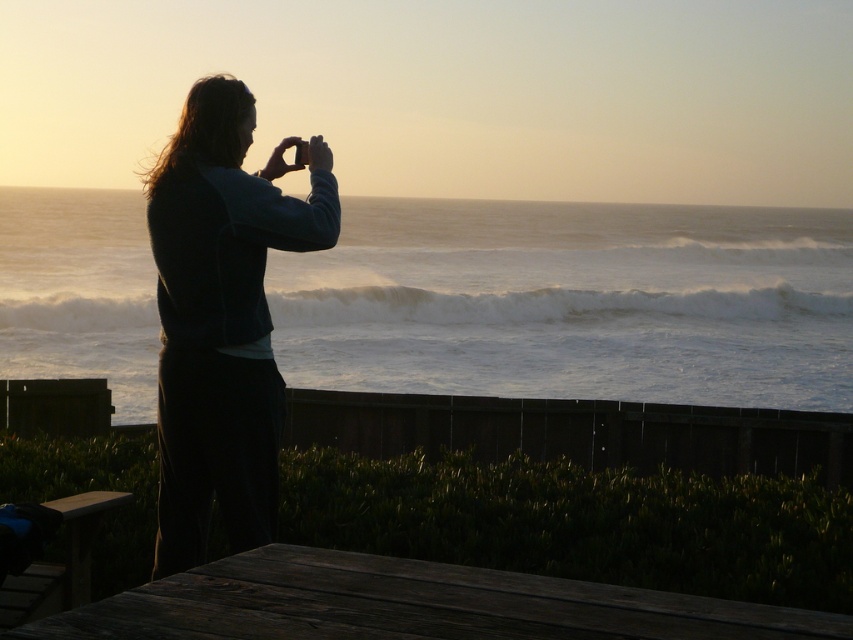
Question: Can you confirm if silhouette fabric jacket at left is smaller than dark brown wooden picnic table at lower center?

Choices:
 (A) yes
 (B) no

Answer: (B)

Question: Does silhouette fabric jacket at left lie behind dark brown wooden picnic table at lower center?

Choices:
 (A) no
 (B) yes

Answer: (B)

Question: Does silhouette fabric jacket at left have a lesser width compared to dark brown wooden picnic table at lower center?

Choices:
 (A) no
 (B) yes

Answer: (B)

Question: Among these points, which one is farthest from the camera?

Choices:
 (A) 231,273
 (B) 126,637

Answer: (A)